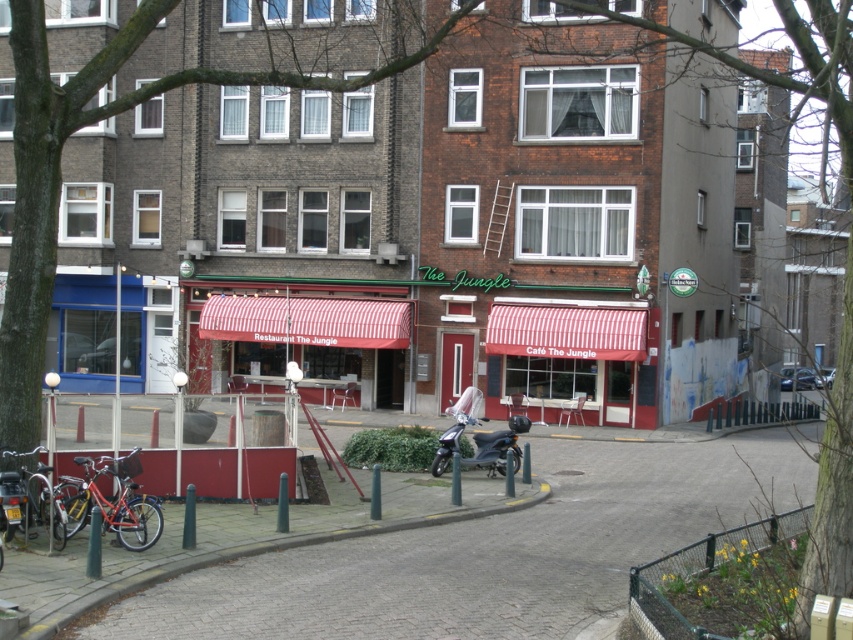
Does red matte bicycle at lower left have a lesser width compared to matte red bicycle at lower left?

In fact, red matte bicycle at lower left might be wider than matte red bicycle at lower left.

Who is lower down, red matte bicycle at lower left or matte red bicycle at lower left?

red matte bicycle at lower left is below.

This screenshot has height=640, width=853. Find the location of `red matte bicycle at lower left`. red matte bicycle at lower left is located at coordinates (112, 500).

The height and width of the screenshot is (640, 853). In order to click on red matte bicycle at lower left in this screenshot , I will do pyautogui.click(x=112, y=500).

Between point (393, 348) and point (48, 502), which one is positioned in front?

Positioned in front is point (48, 502).

Is point (293, 326) less distant than point (10, 484)?

That is False.

Is point (263, 326) positioned in front of point (12, 506)?

No, (263, 326) is further to viewer.

Identify the location of red striped awning at center. (306, 321).

Who is more distant from viewer, (302, 340) or (500, 458)?

The point (302, 340) is more distant.

Where is `red striped awning at center`? The width and height of the screenshot is (853, 640). red striped awning at center is located at coordinates (x=306, y=321).

Which is behind, point (221, 323) or point (498, 442)?

The point (221, 323) is behind.

At what (x,y) coordinates should I click in order to perform the action: click on red striped awning at center. Please return your answer as a coordinate pair (x, y). Looking at the image, I should click on (306, 321).